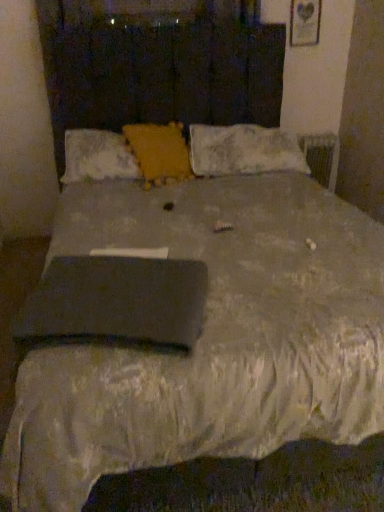
Question: Relative to white fluffy pillow at upper right, arranged as the third pillow when viewed from the left, is yellow textured pillow at center, which is the second pillow from left to right, in front or behind?

Choices:
 (A) front
 (B) behind

Answer: (A)

Question: From a real-world perspective, is yellow textured pillow at center, which is the second pillow from left to right, above or below white fluffy pillow at upper right, arranged as the third pillow when viewed from the left?

Choices:
 (A) below
 (B) above

Answer: (B)

Question: Which of these objects is positioned closest to the white fluffy pillow at upper right, acting as the 1th pillow starting from the right?

Choices:
 (A) black matte pad at center
 (B) yellow textured pillow at center, which appears as the second pillow when viewed from the right
 (C) velvet yellow pillow at center, which is the third pillow in right-to-left order

Answer: (B)

Question: Estimate the real-world distances between objects in this image. Which object is closer to the white fluffy pillow at upper right, acting as the 1th pillow starting from the right?

Choices:
 (A) yellow textured pillow at center, which appears as the second pillow when viewed from the right
 (B) velvet yellow pillow at center, which ranks as the 1th pillow in left-to-right order
 (C) black matte pad at center

Answer: (A)